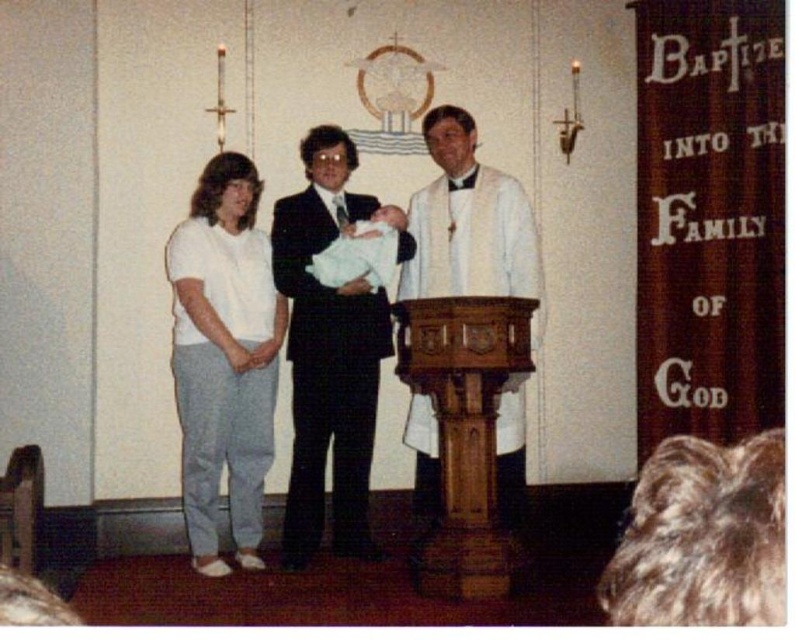
Question: Considering the relative positions of white cotton pants at left and white soft cloth at center in the image provided, where is white cotton pants at left located with respect to white soft cloth at center?

Choices:
 (A) left
 (B) right

Answer: (A)

Question: Can you confirm if matte black suit at center is thinner than white clothed man at center?

Choices:
 (A) yes
 (B) no

Answer: (B)

Question: Estimate the real-world distances between objects in this image. Which object is farther from the white soft cloth at center?

Choices:
 (A) matte black suit at center
 (B) white cotton pants at left
 (C) wooden at center
 (D) white clothed man at center

Answer: (B)

Question: Considering the relative positions of wooden at center and white soft cloth at center in the image provided, where is wooden at center located with respect to white soft cloth at center?

Choices:
 (A) above
 (B) below

Answer: (B)

Question: Which object is closer to the camera taking this photo?

Choices:
 (A) wooden at center
 (B) white soft cloth at center

Answer: (A)

Question: Among these points, which one is nearest to the camera?

Choices:
 (A) (192, 432)
 (B) (452, 387)

Answer: (B)